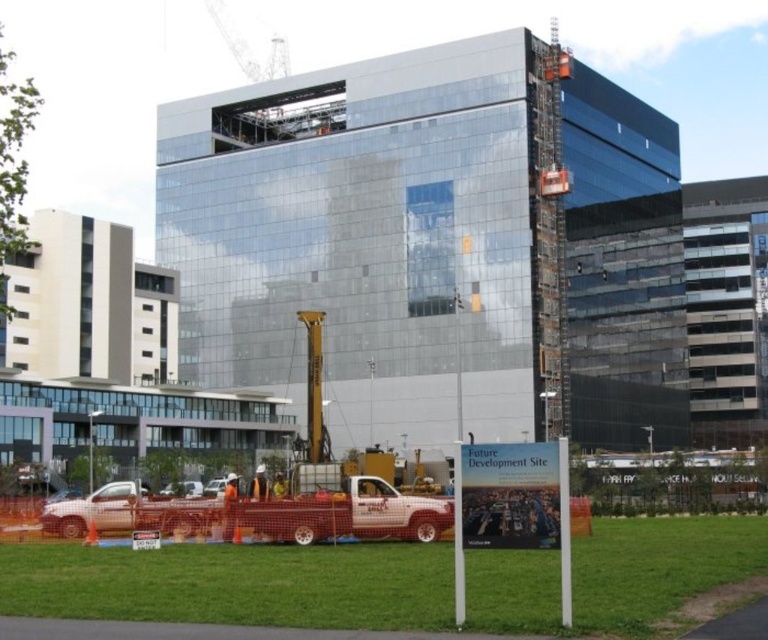
You are a construction worker standing at the edge of the orange safety fencing. You need to walk to the white matte truck at lower left to retrieve a tool. As you look towards the truck, which direction should you head relative to the green grass at lower center?

You should head to the left of the green grass at lower center because the white matte truck at lower left is positioned to the left of it according to the description.